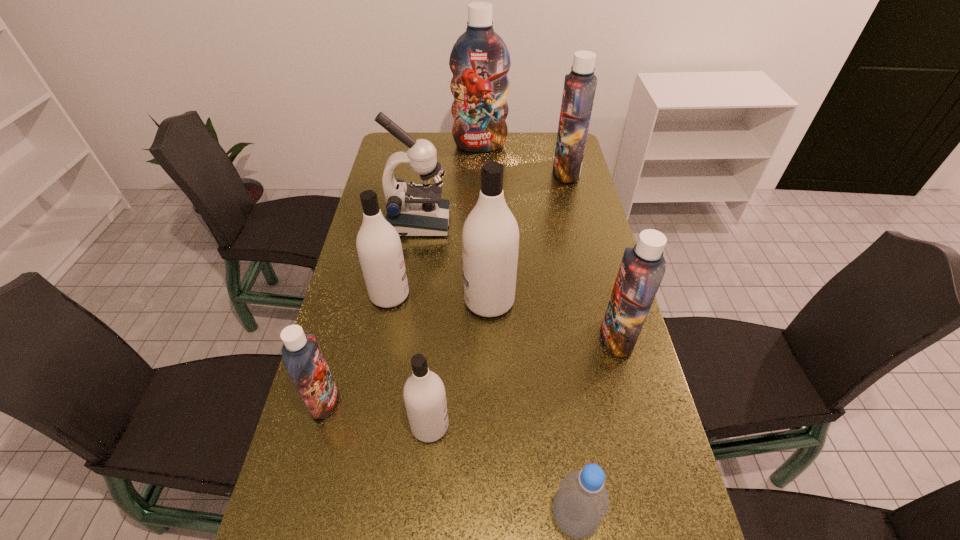
This screenshot has width=960, height=540. Find the location of `the tallest shampoo`. the tallest shampoo is located at coordinates (479, 60).

Where is `the farthest blue shampoo`? the farthest blue shampoo is located at coordinates (479, 60).

Find the location of `the biggest white shampoo`. the biggest white shampoo is located at coordinates (490, 237).

Identify the location of the third smallest blue shampoo. Image resolution: width=960 pixels, height=540 pixels. (580, 84).

This screenshot has height=540, width=960. I want to click on the second farthest blue shampoo, so click(x=580, y=84).

This screenshot has width=960, height=540. I want to click on the third farthest object, so click(x=416, y=210).

Where is `the second nearest blue shampoo`? This screenshot has height=540, width=960. the second nearest blue shampoo is located at coordinates (642, 268).

At what (x,y) coordinates should I click in order to perform the action: click on the sixth shampoo from right to left. Please return your answer as a coordinate pair (x, y). The width and height of the screenshot is (960, 540). Looking at the image, I should click on (379, 248).

Image resolution: width=960 pixels, height=540 pixels. In order to click on the second smallest white shampoo in this screenshot , I will do `click(379, 248)`.

In order to click on the smallest blue shampoo in this screenshot , I will do click(x=303, y=359).